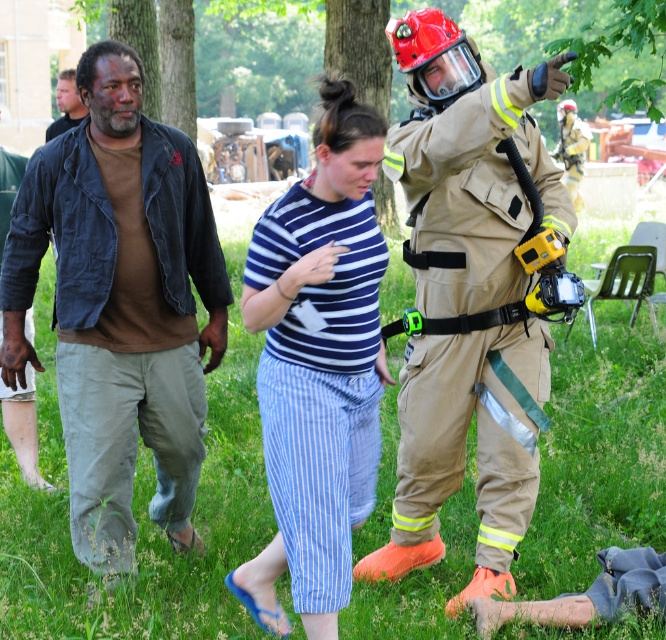
Question: Which object appears closest to the camera in this image?

Choices:
 (A) brown cotton shirt at upper left
 (B) tan protective suit at center
 (C) tan fireproof suit at center
 (D) brown cotton shirt at left

Answer: (C)

Question: Does brown cotton shirt at left appear over tan protective suit at center?

Choices:
 (A) no
 (B) yes

Answer: (A)

Question: Which object appears farthest from the camera in this image?

Choices:
 (A) tan protective suit at center
 (B) brown cotton shirt at upper left
 (C) blue striped pants at center

Answer: (A)

Question: Which of the following is the closest to the observer?

Choices:
 (A) tan protective suit at center
 (B) brown cotton shirt at left

Answer: (B)

Question: Can you confirm if blue striped pants at center is smaller than tan protective suit at center?

Choices:
 (A) yes
 (B) no

Answer: (B)

Question: In this image, where is green grass at center located relative to blue striped pants at center?

Choices:
 (A) above
 (B) below

Answer: (B)